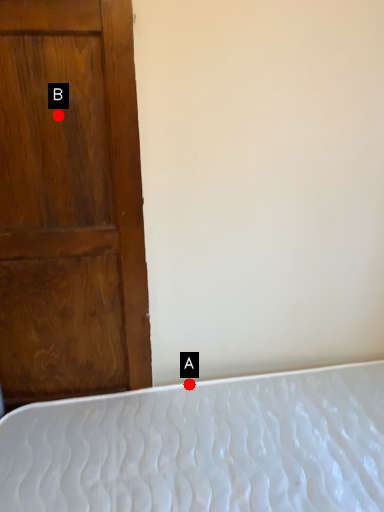
Question: Two points are circled on the image, labeled by A and B beside each circle. Which of the following is the farthest from the observer?

Choices:
 (A) A is further
 (B) B is further

Answer: (A)